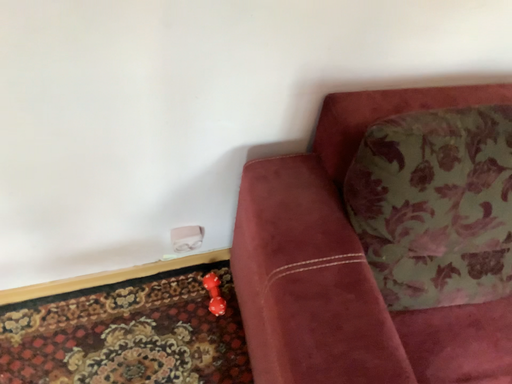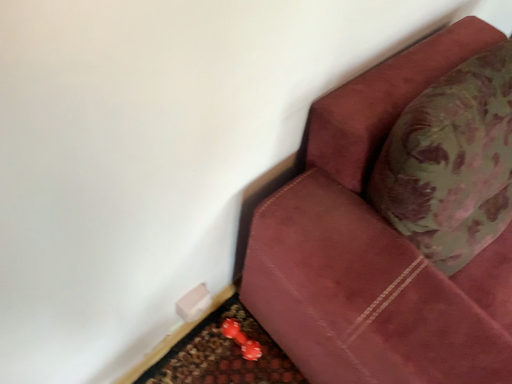
Question: Which way did the camera rotate in the video?

Choices:
 (A) rotated right
 (B) rotated left

Answer: (A)